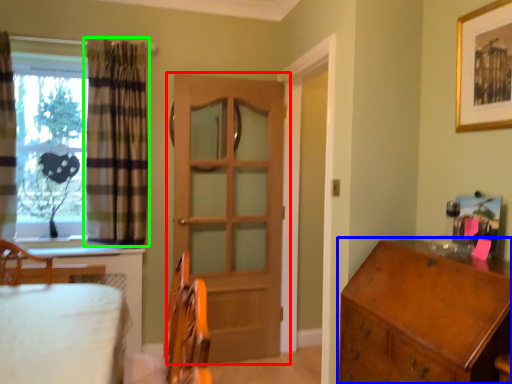
Question: Which is farther away from door (highlighted by a red box)? chest of drawers (highlighted by a blue box) or curtain (highlighted by a green box)?

Choices:
 (A) chest of drawers
 (B) curtain

Answer: (A)